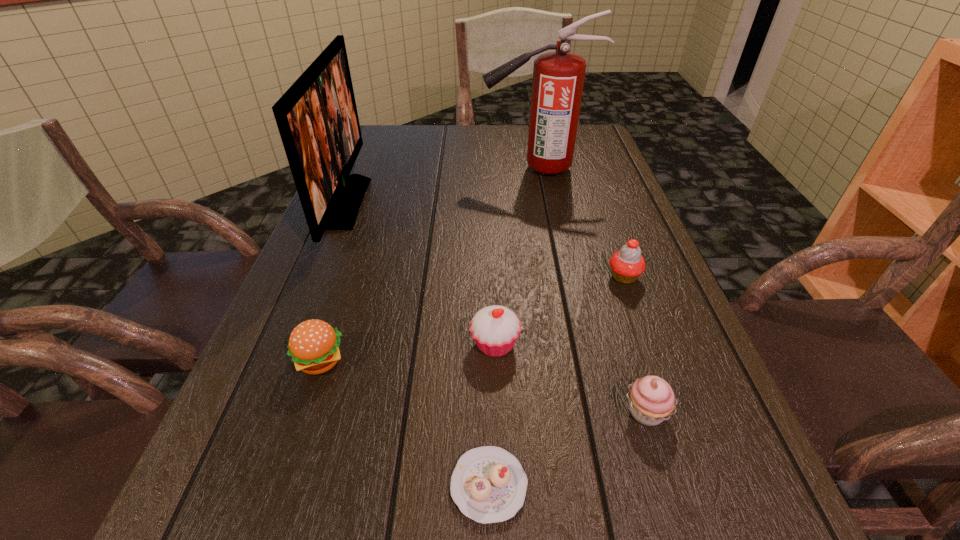
At what (x,y) coordinates should I click in order to perform the action: click on the tallest object. Please return your answer as a coordinate pair (x, y). Looking at the image, I should click on (558, 77).

What are the coordinates of `monitor` in the screenshot? It's located at (317, 119).

Locate an element on the screen. the fifth nearest object is located at coordinates (627, 264).

Identify the location of the third nearest cupcake. Image resolution: width=960 pixels, height=540 pixels. (495, 329).

This screenshot has width=960, height=540. I want to click on hamburger, so click(x=314, y=345).

You are a GUI agent. You are given a task and a screenshot of the screen. Output one action in this format:
    pyautogui.click(x=<x>, y=<y>)
    Task: Click on the third tallest cupcake
    
    Given the screenshot: What is the action you would take?
    pyautogui.click(x=651, y=399)

Locate an element on the screen. This screenshot has width=960, height=540. the sixth farthest object is located at coordinates (651, 399).

Locate an element on the screen. This screenshot has width=960, height=540. the nearest object is located at coordinates (488, 484).

Locate an element on the screen. the shortest cupcake is located at coordinates (488, 484).

You are a GUI agent. You are given a task and a screenshot of the screen. Output one action in this format:
    pyautogui.click(x=<x>, y=<y>)
    Task: Click on the vacant space located 0.310m at the nozzle of the tallest object
    
    Given the screenshot: What is the action you would take?
    pyautogui.click(x=375, y=169)